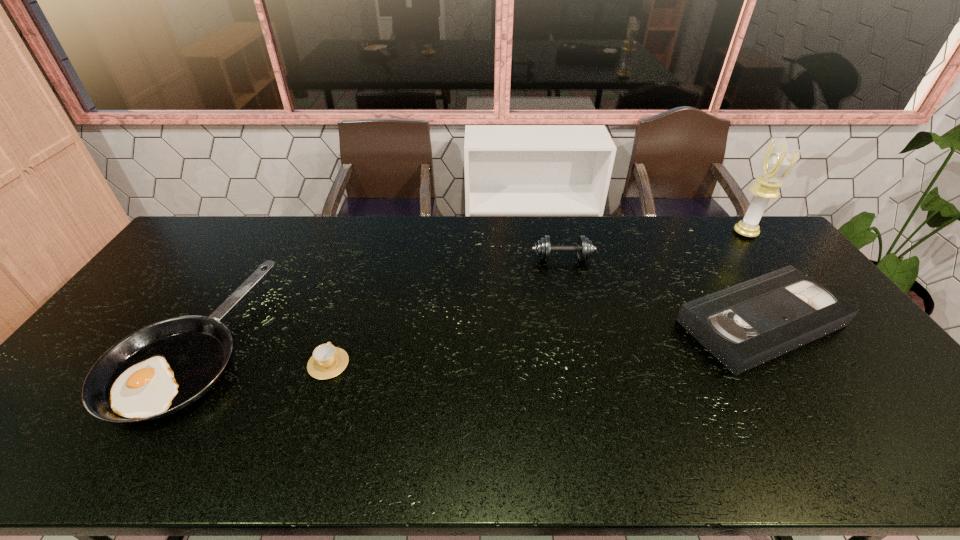
You are a GUI agent. You are given a task and a screenshot of the screen. Output one action in this format:
    pyautogui.click(x=<x>, y=<y>)
    Task: Click on the free spot that satisfies the following two spatial constraints: 1. on the front-facing side of the farthest object; 2. on the front side of the dumbbell
    This screenshot has width=960, height=540.
    Given the screenshot: What is the action you would take?
    pyautogui.click(x=766, y=259)

The image size is (960, 540). I want to click on vacant space that satisfies the following two spatial constraints: 1. with the handle on the side of the cup; 2. on the right side of the fourth nearest object, so pyautogui.click(x=362, y=259).

The image size is (960, 540). Identify the location of free space that satisfies the following two spatial constraints: 1. on the front-facing side of the award; 2. on the front side of the frying pan. pyautogui.click(x=831, y=343).

Identify the location of free location that satisfies the following two spatial constraints: 1. with the handle on the side of the second object from left to right; 2. on the left side of the fourth nearest object. (362, 259).